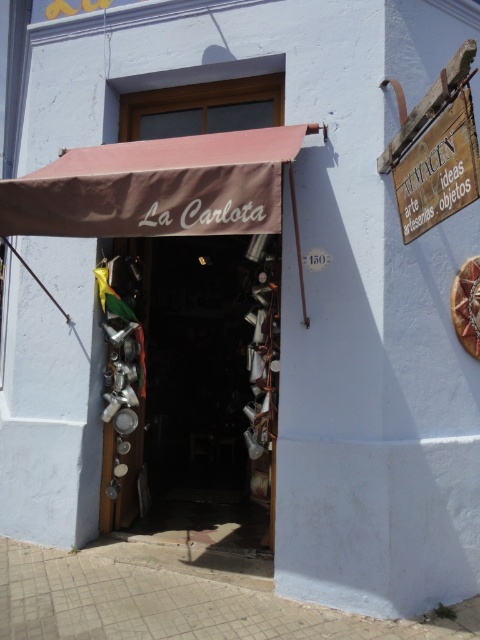
You are a customer entering the shop and want to read the wooden sign at upper right. However, the brown fabric awning at upper center is blocking your view. Can you move the awning to see the sign better?

The brown fabric awning at upper center is positioned over the wooden sign at upper right, so moving it might allow you to see the sign better.

You are a customer entering the shop and notice the metallic pots at center and the brown fabric awning at upper center. Which object is closer to the entrance of the shop?

The metallic pots at center are closer to the entrance of the shop because they are positioned below the brown fabric awning at upper center, which is located higher up.